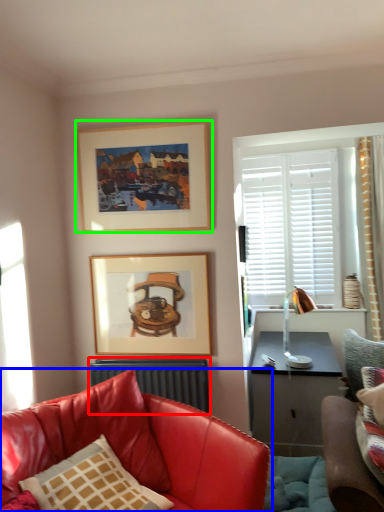
Question: Which object is the closest to the radiator (highlighted by a red box)? Choose among these: studio couch (highlighted by a blue box) or picture frame (highlighted by a green box).

Choices:
 (A) studio couch
 (B) picture frame

Answer: (A)